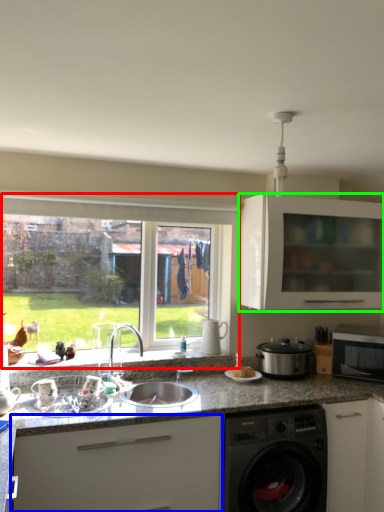
Question: Which is nearer to the window (highlighted by a red box)? cabinetry (highlighted by a blue box) or cabinetry (highlighted by a green box).

Choices:
 (A) cabinetry
 (B) cabinetry

Answer: (B)